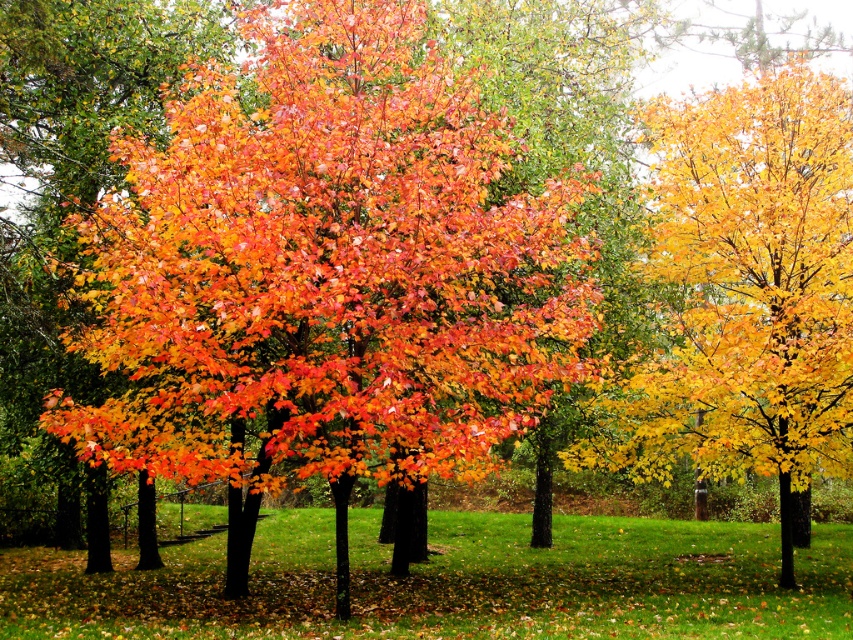
You are standing in the autumn scene and want to pick up some leaves. Which leaves, the shiny orange leaves at center or the golden yellow leaves at right, are higher up from the ground?

The shiny orange leaves at center are higher up from the ground than the golden yellow leaves at right because they are positioned above them.